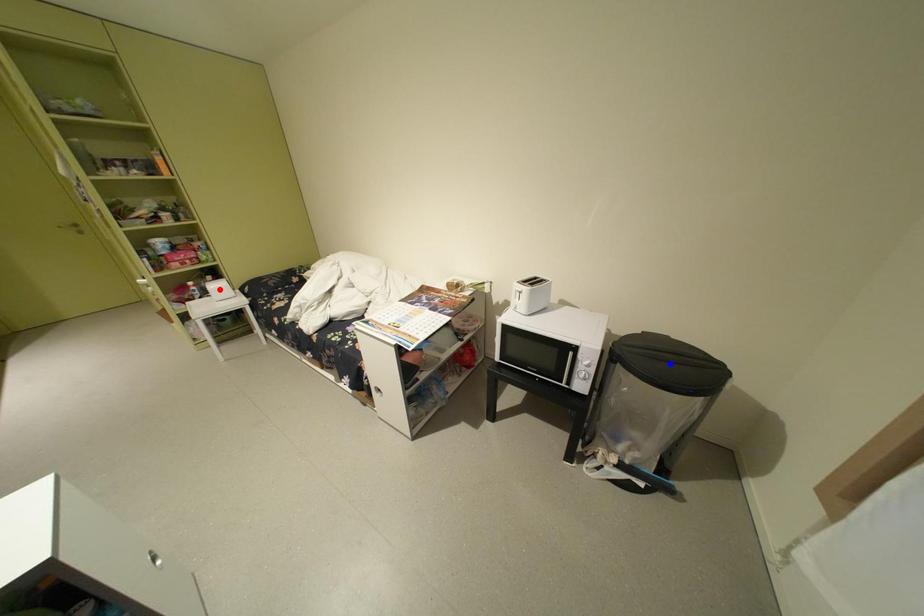
Question: In the image, two points are highlighted. Which point is nearer to the camera? Reply with the corresponding letter.

Choices:
 (A) blue point
 (B) red point

Answer: (A)